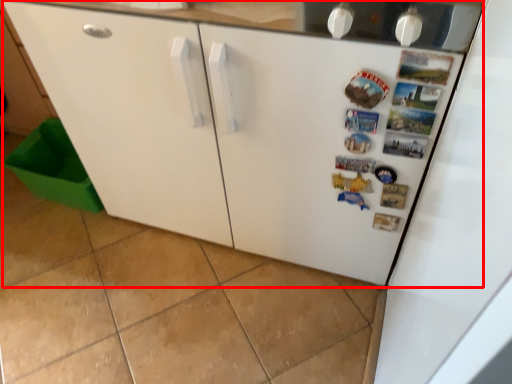
Question: From the image's perspective, where is refrigerator (annotated by the red box) located relative to cabinetry?

Choices:
 (A) below
 (B) above

Answer: (B)